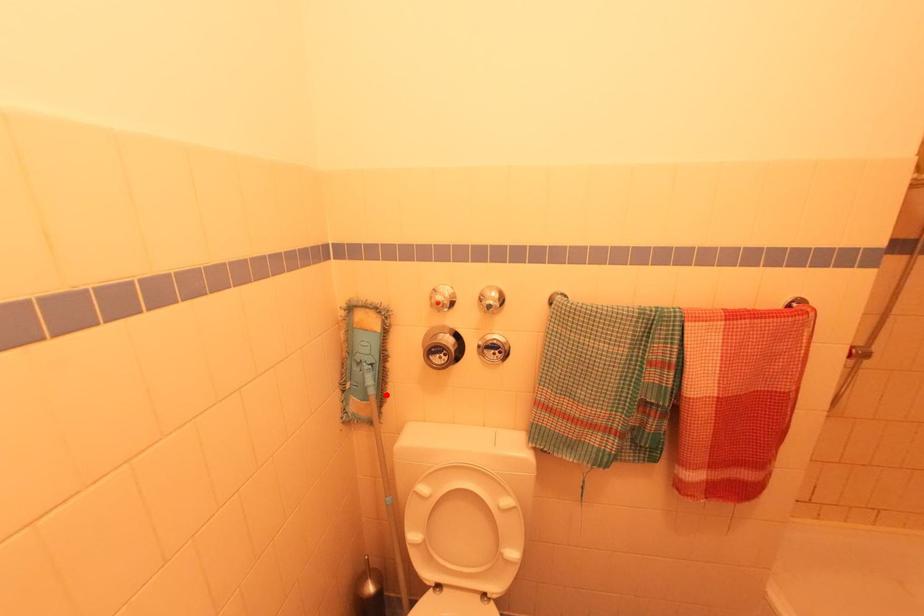
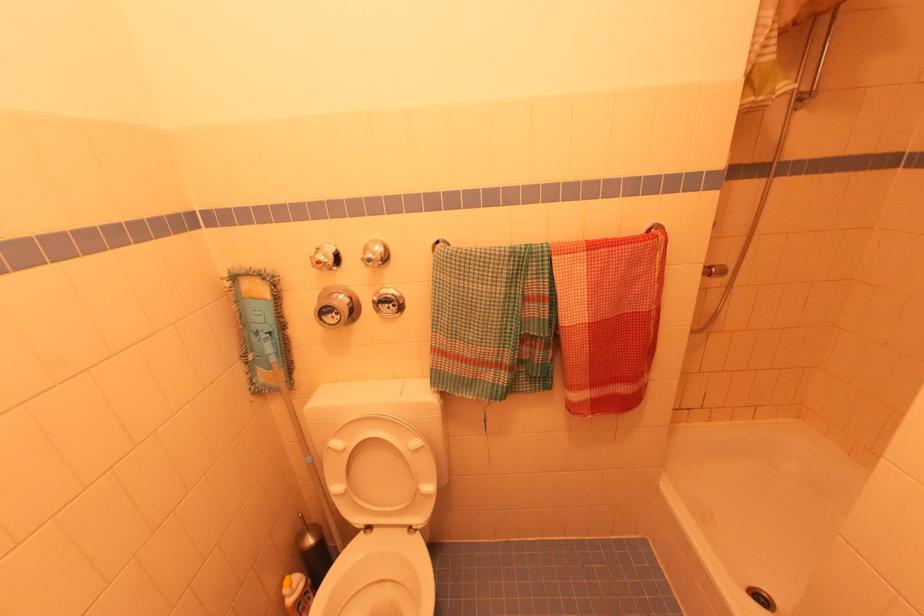
Find the pixel in the second image that matches the highlighted location in the first image.

(293, 361)